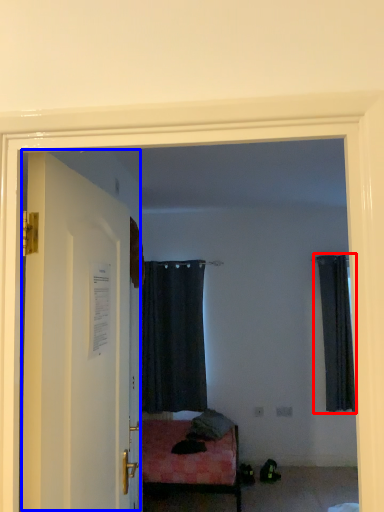
Question: Which object is further to the camera taking this photo, curtain (highlighted by a red box) or door (highlighted by a blue box)?

Choices:
 (A) curtain
 (B) door

Answer: (A)